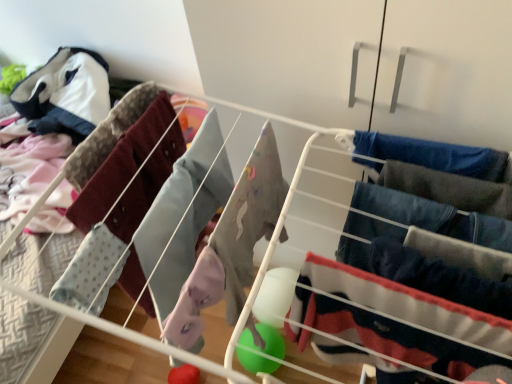
Question: From the image's perspective, is velvet navy pants at center right, the 3th clothing positioned from the right, located above or below light blue fabric at left, which ranks as the 1th clothing in left-to-right order?

Choices:
 (A) above
 (B) below

Answer: (B)

Question: From a real-world perspective, is velvet navy pants at center right, the 3th clothing positioned from the right, physically located above or below light blue fabric at left, which ranks as the 1th clothing in left-to-right order?

Choices:
 (A) above
 (B) below

Answer: (B)

Question: Which is nearer to the light blue fabric at left, which ranks as the 4th clothing in right-to-left order?

Choices:
 (A) dark blue fabric pants at right, which ranks as the 1th clothing in right-to-left order
 (B) denim jeans at right, acting as the 2th clothing starting from the right
 (C) velvet navy pants at center right, placed as the 2th clothing when sorted from left to right

Answer: (C)

Question: Which object is positioned closest to the light blue fabric at left, which ranks as the 1th clothing in left-to-right order?

Choices:
 (A) denim jeans at right, which is the 3th clothing from left to right
 (B) dark blue fabric pants at right, the fourth clothing positioned from the left
 (C) velvet navy pants at center right, the 3th clothing positioned from the right

Answer: (C)